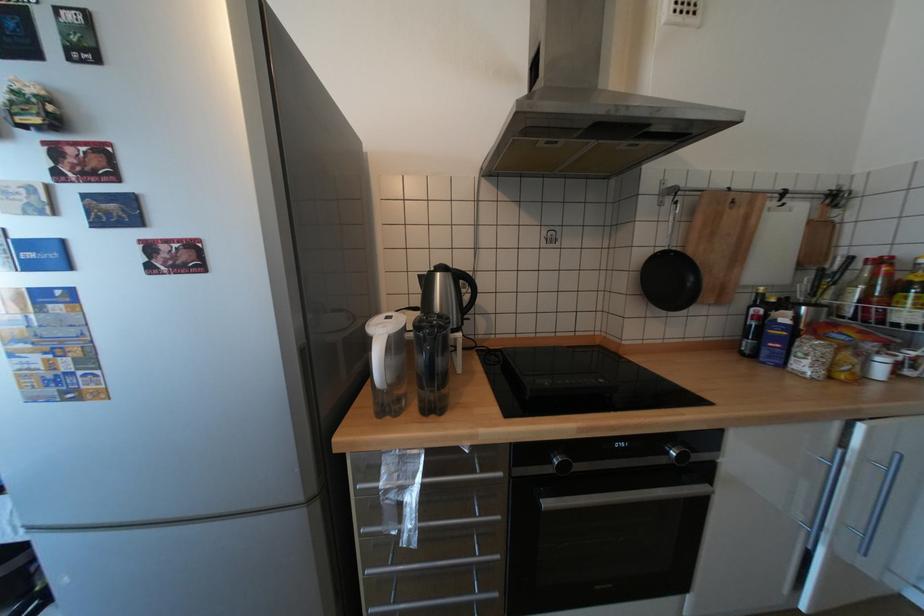
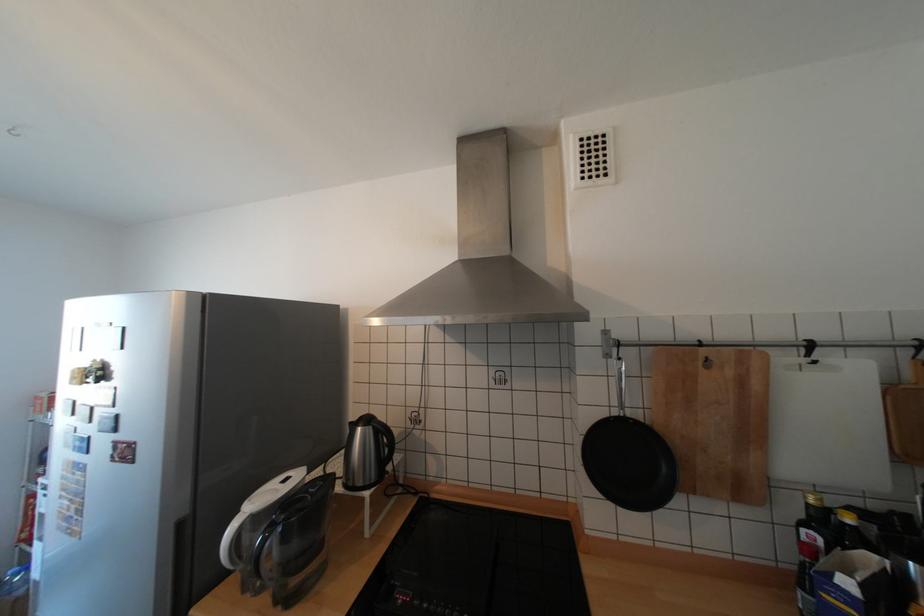
Question: The images are taken continuously from a first-person perspective. In which direction is your viewpoint rotating?

Choices:
 (A) Left
 (B) Right
 (C) Up
 (D) Down

Answer: (A)